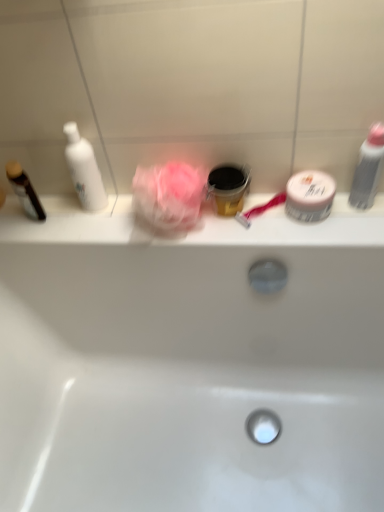
In the scene shown: Measure the distance between point (358, 494) and camera.

The distance of point (358, 494) from camera is 93.70 centimeters.

This screenshot has width=384, height=512. What are the coordinates of `white glossy bathtub at center` in the screenshot? It's located at (189, 362).

In the scene shown: What is the approximate height of white matte jar at right, placed as the third toiletry when sorted from left to right?

white matte jar at right, placed as the third toiletry when sorted from left to right, is 2.61 inches tall.

This screenshot has height=512, width=384. What do you see at coordinates (24, 190) in the screenshot? I see `dark brown glossy bottle at left, which is the 1th toiletry from left to right` at bounding box center [24, 190].

The height and width of the screenshot is (512, 384). What do you see at coordinates (368, 169) in the screenshot? I see `gray matte bottle at right, the 1th toiletry in the right-to-left sequence` at bounding box center [368, 169].

You are a GUI agent. You are given a task and a screenshot of the screen. Output one action in this format:
    pyautogui.click(x=<x>, y=<y>)
    Task: Click on the white glossy bathtub at center
    The width and height of the screenshot is (384, 512).
    Given the screenshot: What is the action you would take?
    [x=189, y=362]

Can you tell me how much white glossy bathtub at center and white matte jar at right, placed as the third toiletry when sorted from left to right, differ in facing direction?

white glossy bathtub at center and white matte jar at right, placed as the third toiletry when sorted from left to right, are facing 1.41 degrees away from each other.

From the image's perspective, is white glossy bathtub at center positioned above or below white matte jar at right, which appears as the second toiletry when viewed from the right?

Based on their image positions, white glossy bathtub at center is located beneath white matte jar at right, which appears as the second toiletry when viewed from the right.

Based on the photo, could you tell me if white glossy bathtub at center is facing white matte jar at right, placed as the third toiletry when sorted from left to right?

No, white glossy bathtub at center is not turned towards white matte jar at right, placed as the third toiletry when sorted from left to right.

Is white glossy bathtub at center at the right side of white matte jar at right, placed as the third toiletry when sorted from left to right?

No, white glossy bathtub at center is not to the right of white matte jar at right, placed as the third toiletry when sorted from left to right.

From the image's perspective, between white matte jar at right, placed as the third toiletry when sorted from left to right, and dark brown glossy bottle at left, which is the 1th toiletry from left to right, which one is located above?

From the image's view, dark brown glossy bottle at left, which is the 1th toiletry from left to right, is above.

Considering the sizes of objects white matte jar at right, which appears as the second toiletry when viewed from the right, and dark brown glossy bottle at left, which appears as the 4th toiletry when viewed from the right, in the image provided, who is bigger, white matte jar at right, which appears as the second toiletry when viewed from the right, or dark brown glossy bottle at left, which appears as the 4th toiletry when viewed from the right,?

white matte jar at right, which appears as the second toiletry when viewed from the right, is bigger.

Could you tell me if white matte jar at right, placed as the third toiletry when sorted from left to right, is turned towards dark brown glossy bottle at left, which appears as the 4th toiletry when viewed from the right?

No, white matte jar at right, placed as the third toiletry when sorted from left to right, is not oriented towards dark brown glossy bottle at left, which appears as the 4th toiletry when viewed from the right.

Is the depth of white matte jar at right, placed as the third toiletry when sorted from left to right, greater than that of dark brown glossy bottle at left, which is the 1th toiletry from left to right?

No, it is not.

Choose the correct answer: Is pink fabric rose at center inside black plastic cup at center, arranged as the third toiletry when viewed from the right, or outside it?

pink fabric rose at center is spatially situated outside black plastic cup at center, arranged as the third toiletry when viewed from the right.

Could you tell me if pink fabric rose at center is turned towards black plastic cup at center, which is counted as the second toiletry, starting from the left?

No, pink fabric rose at center is not facing towards black plastic cup at center, which is counted as the second toiletry, starting from the left.

Is pink fabric rose at center closer to camera compared to black plastic cup at center, arranged as the third toiletry when viewed from the right?

Yes, the depth of pink fabric rose at center is less than that of black plastic cup at center, arranged as the third toiletry when viewed from the right.

From the image's perspective, which one is positioned higher, pink fabric rose at center or black plastic cup at center, which is counted as the second toiletry, starting from the left?

From the image's view, black plastic cup at center, which is counted as the second toiletry, starting from the left, is above.

Considering the relative positions of white glossy bottle at left and gray matte bottle at right, the 4th toiletry positioned from the left, in the image provided, is white glossy bottle at left to the left of gray matte bottle at right, the 4th toiletry positioned from the left, from the viewer's perspective?

Yes, white glossy bottle at left is to the left of gray matte bottle at right, the 4th toiletry positioned from the left.

Find the location of `toiletry that is the 3rd object to the right of the white glossy bottle at left, starting at the anchor`. toiletry that is the 3rd object to the right of the white glossy bottle at left, starting at the anchor is located at coordinates (368, 169).

From a real-world perspective, which object stands above the other?

white glossy bottle at left is physically above.

From the image's perspective, is white glossy bottle at left on gray matte bottle at right, the 4th toiletry positioned from the left?

Yes, from the image's perspective, white glossy bottle at left is on top of gray matte bottle at right, the 4th toiletry positioned from the left.

From the image's perspective, is black plastic cup at center, arranged as the third toiletry when viewed from the right, under white glossy bathtub at center?

No, from the image's perspective, black plastic cup at center, arranged as the third toiletry when viewed from the right, is not below white glossy bathtub at center.

Which object is further away from the camera taking this photo, black plastic cup at center, which is counted as the second toiletry, starting from the left, or white glossy bathtub at center?

Positioned behind is black plastic cup at center, which is counted as the second toiletry, starting from the left.

Is black plastic cup at center, arranged as the third toiletry when viewed from the right, facing towards white glossy bathtub at center?

No.

From a real-world perspective, is black plastic cup at center, which is counted as the second toiletry, starting from the left, above or below white glossy bathtub at center?

black plastic cup at center, which is counted as the second toiletry, starting from the left, is above white glossy bathtub at center.

Can you confirm if dark brown glossy bottle at left, which appears as the 4th toiletry when viewed from the right, is taller than black plastic cup at center, which is counted as the second toiletry, starting from the left?

Yes, dark brown glossy bottle at left, which appears as the 4th toiletry when viewed from the right, is taller than black plastic cup at center, which is counted as the second toiletry, starting from the left.

Considering the sizes of dark brown glossy bottle at left, which appears as the 4th toiletry when viewed from the right, and black plastic cup at center, which is counted as the second toiletry, starting from the left, in the image, is dark brown glossy bottle at left, which appears as the 4th toiletry when viewed from the right, bigger or smaller than black plastic cup at center, which is counted as the second toiletry, starting from the left,?

Considering their sizes, dark brown glossy bottle at left, which appears as the 4th toiletry when viewed from the right, takes up less space than black plastic cup at center, which is counted as the second toiletry, starting from the left.

Consider the image. Considering the relative positions of dark brown glossy bottle at left, which is the 1th toiletry from left to right, and black plastic cup at center, which is counted as the second toiletry, starting from the left, in the image provided, is dark brown glossy bottle at left, which is the 1th toiletry from left to right, behind black plastic cup at center, which is counted as the second toiletry, starting from the left,?

Yes, the depth of dark brown glossy bottle at left, which is the 1th toiletry from left to right, is greater than that of black plastic cup at center, which is counted as the second toiletry, starting from the left.

Is black plastic cup at center, arranged as the third toiletry when viewed from the right, facing towards gray matte bottle at right, the 4th toiletry positioned from the left?

No, black plastic cup at center, arranged as the third toiletry when viewed from the right, is not turned towards gray matte bottle at right, the 4th toiletry positioned from the left.

Does black plastic cup at center, which is counted as the second toiletry, starting from the left, come behind gray matte bottle at right, the 4th toiletry positioned from the left?

Yes, the depth of black plastic cup at center, which is counted as the second toiletry, starting from the left, is greater than that of gray matte bottle at right, the 4th toiletry positioned from the left.

Is black plastic cup at center, which is counted as the second toiletry, starting from the left, taller or shorter than gray matte bottle at right, the 1th toiletry in the right-to-left sequence?

Considering their sizes, black plastic cup at center, which is counted as the second toiletry, starting from the left, has less height than gray matte bottle at right, the 1th toiletry in the right-to-left sequence.

Measure the distance from black plastic cup at center, which is counted as the second toiletry, starting from the left, to gray matte bottle at right, the 1th toiletry in the right-to-left sequence.

The distance of black plastic cup at center, which is counted as the second toiletry, starting from the left, from gray matte bottle at right, the 1th toiletry in the right-to-left sequence, is 9.88 inches.

At what (x,y) coordinates should I click in order to perform the action: click on the 2nd toiletry to the right of the white glossy bathtub at center, counting from the anchor's position. Please return your answer as a coordinate pair (x, y). Looking at the image, I should click on (310, 196).

From a real-world perspective, which toiletry is the 2nd one above the white matte jar at right, placed as the third toiletry when sorted from left to right? Please provide its 2D coordinates.

[(24, 190)]

Based on their spatial positions, is black plastic cup at center, which is counted as the second toiletry, starting from the left, or white matte jar at right, which appears as the second toiletry when viewed from the right, closer to dark brown glossy bottle at left, which appears as the 4th toiletry when viewed from the right?

black plastic cup at center, which is counted as the second toiletry, starting from the left, lies closer to dark brown glossy bottle at left, which appears as the 4th toiletry when viewed from the right, than the other object.

From the image, which object appears to be nearer to white glossy bottle at left, white matte jar at right, which appears as the second toiletry when viewed from the right, or black plastic cup at center, arranged as the third toiletry when viewed from the right?

black plastic cup at center, arranged as the third toiletry when viewed from the right, lies closer to white glossy bottle at left than the other object.

Based on their spatial positions, is black plastic cup at center, arranged as the third toiletry when viewed from the right, or pink fabric rose at center further from dark brown glossy bottle at left, which appears as the 4th toiletry when viewed from the right?

The object further to dark brown glossy bottle at left, which appears as the 4th toiletry when viewed from the right, is black plastic cup at center, arranged as the third toiletry when viewed from the right.

Considering their positions, is white glossy bottle at left positioned further to pink fabric rose at center than black plastic cup at center, which is counted as the second toiletry, starting from the left?

white glossy bottle at left lies further to pink fabric rose at center than the other object.

Based on their spatial positions, is white glossy bathtub at center or pink fabric rose at center closer to gray matte bottle at right, the 4th toiletry positioned from the left?

pink fabric rose at center is positioned closer to the anchor gray matte bottle at right, the 4th toiletry positioned from the left.

Which object lies further to the anchor point white glossy bottle at left, white matte jar at right, placed as the third toiletry when sorted from left to right, or dark brown glossy bottle at left, which is the 1th toiletry from left to right?

The object further to white glossy bottle at left is white matte jar at right, placed as the third toiletry when sorted from left to right.

Looking at the image, which one is located closer to black plastic cup at center, which is counted as the second toiletry, starting from the left, dark brown glossy bottle at left, which appears as the 4th toiletry when viewed from the right, or white matte jar at right, placed as the third toiletry when sorted from left to right?

white matte jar at right, placed as the third toiletry when sorted from left to right.

Estimate the real-world distances between objects in this image. Which object is further from white matte jar at right, placed as the third toiletry when sorted from left to right, gray matte bottle at right, the 1th toiletry in the right-to-left sequence, or black plastic cup at center, which is counted as the second toiletry, starting from the left?

The object further to white matte jar at right, placed as the third toiletry when sorted from left to right, is black plastic cup at center, which is counted as the second toiletry, starting from the left.

Where is `cleaning product located between dark brown glossy bottle at left, which is the 1th toiletry from left to right, and gray matte bottle at right, the 4th toiletry positioned from the left, in the left-right direction`? The image size is (384, 512). cleaning product located between dark brown glossy bottle at left, which is the 1th toiletry from left to right, and gray matte bottle at right, the 4th toiletry positioned from the left, in the left-right direction is located at coordinates (84, 170).

At what (x,y) coordinates should I click in order to perform the action: click on rose situated between white glossy bottle at left and black plastic cup at center, arranged as the third toiletry when viewed from the right, from left to right. Please return your answer as a coordinate pair (x, y). The width and height of the screenshot is (384, 512). Looking at the image, I should click on (170, 194).

Identify the location of rose between gray matte bottle at right, the 1th toiletry in the right-to-left sequence, and white glossy bathtub at center from top to bottom. The width and height of the screenshot is (384, 512). (170, 194).

Where is `toiletry between dark brown glossy bottle at left, which is the 1th toiletry from left to right, and white matte jar at right, which appears as the second toiletry when viewed from the right`? This screenshot has height=512, width=384. toiletry between dark brown glossy bottle at left, which is the 1th toiletry from left to right, and white matte jar at right, which appears as the second toiletry when viewed from the right is located at coordinates (228, 187).